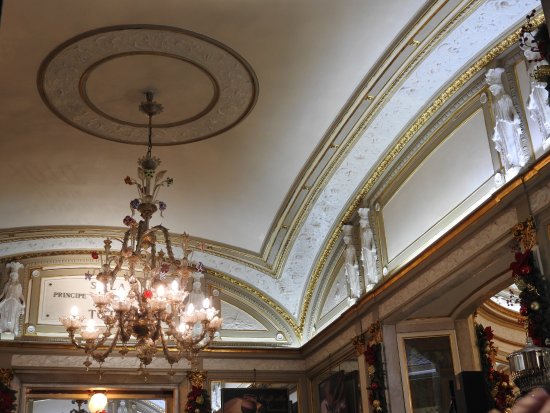
Where is `door`? This screenshot has height=413, width=550. door is located at coordinates (427, 369).